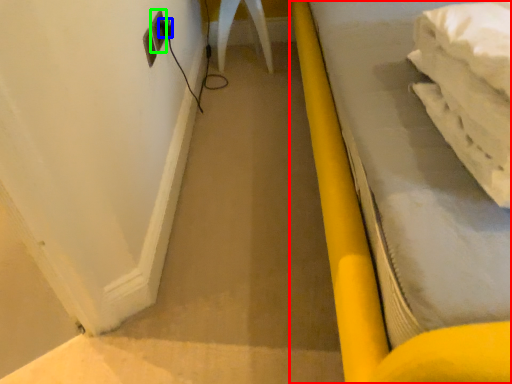
Question: Which object is positioned closest to furniture (highlighted by a red box)? Select from plug (highlighted by a blue box) and electric outlet (highlighted by a green box).

Choices:
 (A) plug
 (B) electric outlet

Answer: (B)